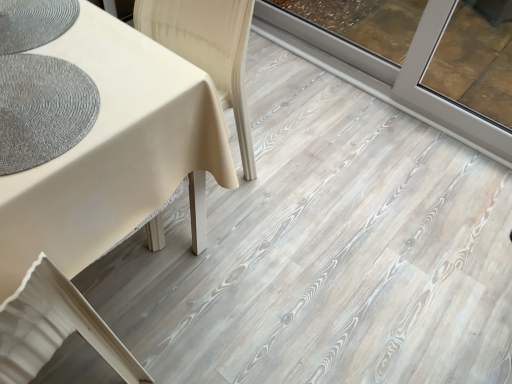
Find the location of a particular element. vacant space underneath textured gray mat at left (from a real-world perspective) is located at coordinates (105, 279).